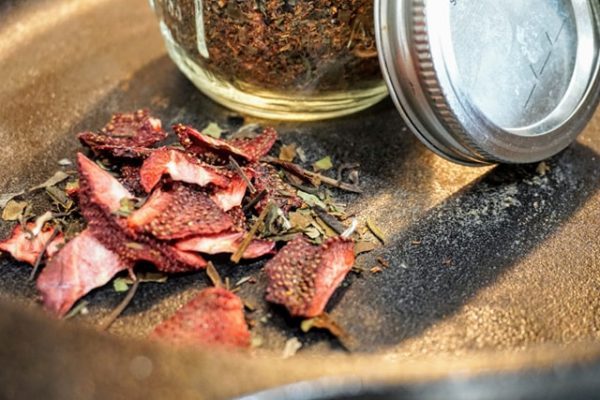
You are a GUI agent. You are given a task and a screenshot of the screen. Output one action in this format:
    pyautogui.click(x=<x>, y=<y>)
    Task: Click on the white residue on pan
    
    Given the screenshot: What is the action you would take?
    pyautogui.click(x=508, y=199), pyautogui.click(x=502, y=210), pyautogui.click(x=456, y=217), pyautogui.click(x=469, y=214), pyautogui.click(x=543, y=186)